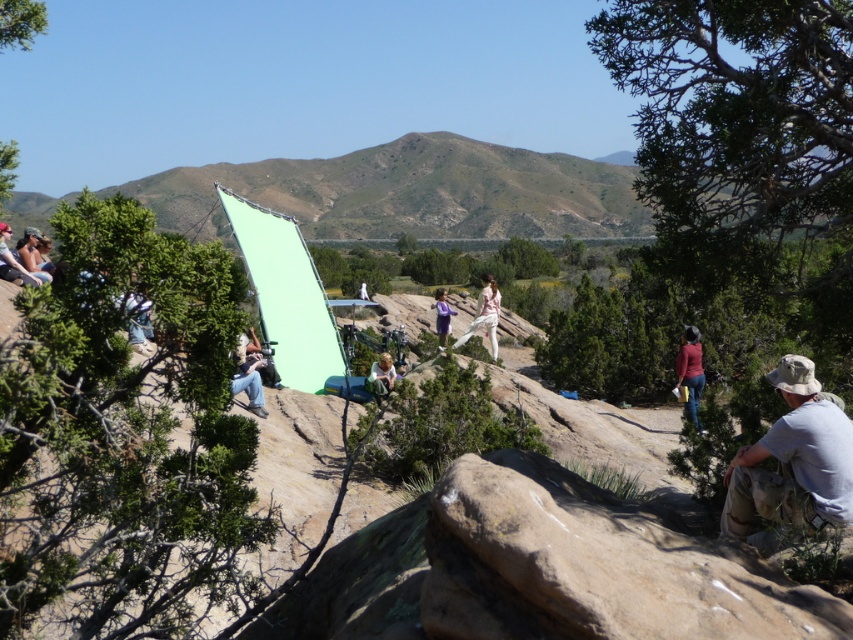
You are standing at the point marked as point (138,323) in the scene. Looking around, you see a large light green screen propped against rocks and a person in white posing in the center. What is the nearest object to you?

The nearest object to you is denim pants at left because the point (138,323) is on denim pants at left.